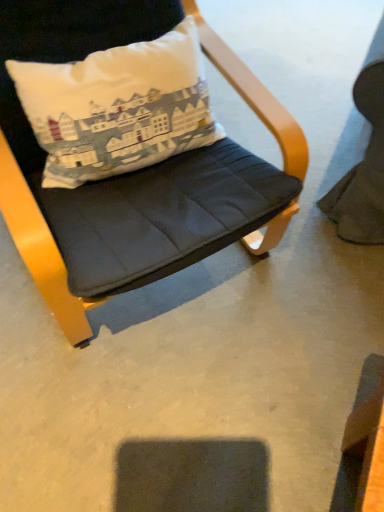
Locate an element on the screen. The height and width of the screenshot is (512, 384). matte black cushion at center is located at coordinates (147, 203).

Image resolution: width=384 pixels, height=512 pixels. Describe the element at coordinates (147, 203) in the screenshot. I see `matte black cushion at center` at that location.

At what (x,y) coordinates should I click in order to perform the action: click on matte black cushion at center. Please return your answer as a coordinate pair (x, y). Looking at the image, I should click on [147, 203].